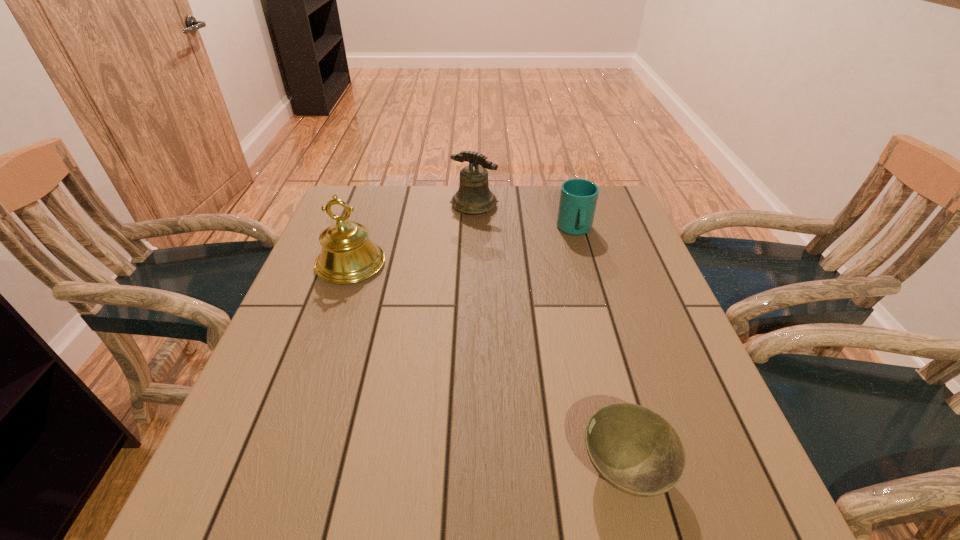
Where is `vacant space at the near edge of the desktop`? The width and height of the screenshot is (960, 540). vacant space at the near edge of the desktop is located at coordinates (483, 484).

The height and width of the screenshot is (540, 960). In order to click on free space at the left edge of the desktop in this screenshot , I will do (334, 383).

Image resolution: width=960 pixels, height=540 pixels. In the image, there is a desktop. Find the location of `free region at the right edge`. free region at the right edge is located at coordinates (631, 247).

You are a GUI agent. You are given a task and a screenshot of the screen. Output one action in this format:
    pyautogui.click(x=<x>, y=<y>)
    Task: Click on the vacant space at the far right corner of the desktop
    
    Given the screenshot: What is the action you would take?
    pyautogui.click(x=595, y=225)

This screenshot has width=960, height=540. I want to click on vacant area that lies between the third object from right to left and the left bell, so click(413, 235).

You are a GUI agent. You are given a task and a screenshot of the screen. Output one action in this format:
    pyautogui.click(x=<x>, y=<y>)
    Task: Click on the blank region between the third tallest object and the shortest object
    The image size is (960, 540).
    Given the screenshot: What is the action you would take?
    pyautogui.click(x=600, y=349)

Locate an element on the screen. The image size is (960, 540). free spot between the nearest object and the farther bell is located at coordinates (549, 338).

Where is `vacant area that lies between the farther bell and the second shortest object`? The width and height of the screenshot is (960, 540). vacant area that lies between the farther bell and the second shortest object is located at coordinates (524, 218).

Locate an element on the screen. Image resolution: width=960 pixels, height=540 pixels. blank region between the right bell and the nearer bell is located at coordinates (413, 235).

The width and height of the screenshot is (960, 540). In order to click on free space between the second shortest object and the farther bell in this screenshot , I will do `click(524, 218)`.